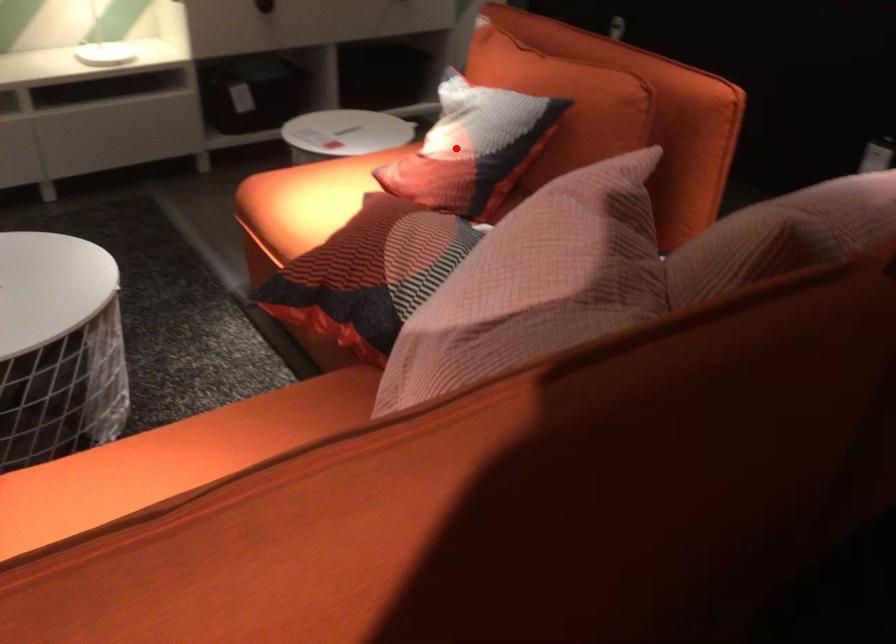
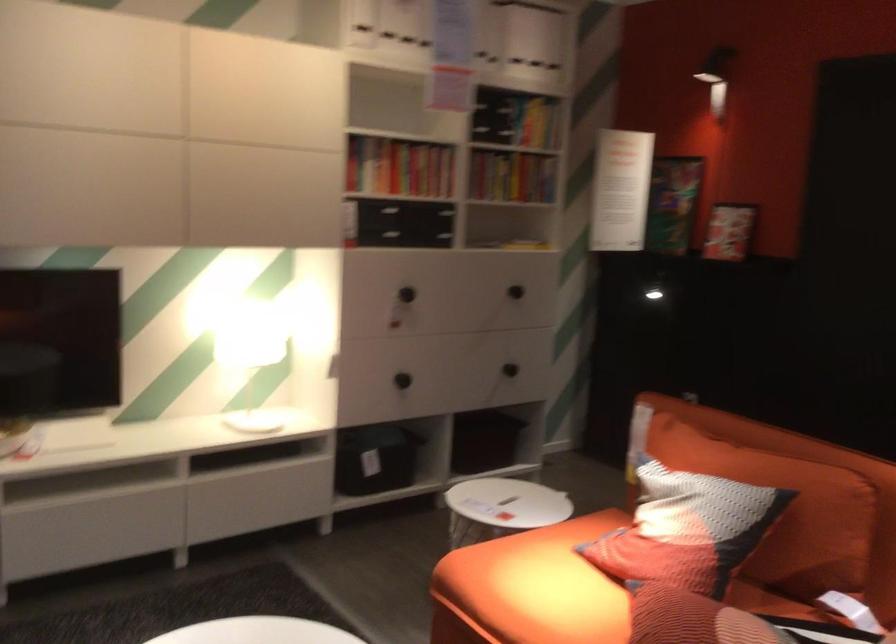
The point at the highlighted location is marked in the first image. Where is the corresponding point in the second image?

(686, 529)